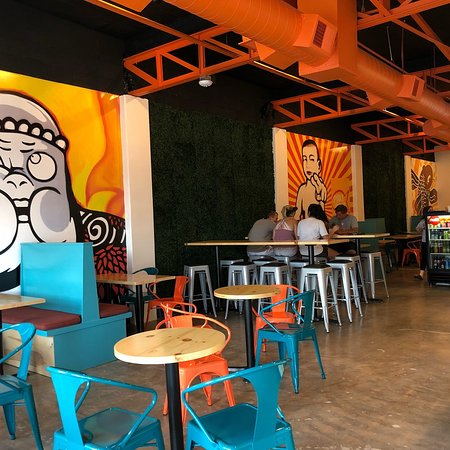
At what (x,y) coordinates should I click in order to perform the action: click on rectangle table. Please return your answer as a coordinate pair (x, y). Looking at the image, I should click on (221, 242), (367, 235).